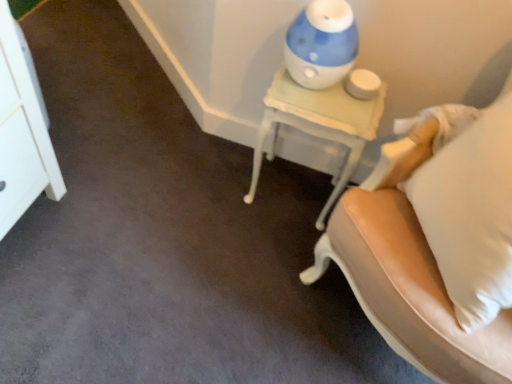
Question: Is white leather chair at right located outside white painted wood nightstand at upper right?

Choices:
 (A) no
 (B) yes

Answer: (B)

Question: From a real-world perspective, is white leather chair at right under white painted wood nightstand at upper right?

Choices:
 (A) yes
 (B) no

Answer: (B)

Question: Considering the relative sizes of white leather chair at right and white painted wood nightstand at upper right in the image provided, is white leather chair at right thinner than white painted wood nightstand at upper right?

Choices:
 (A) yes
 (B) no

Answer: (B)

Question: Are white leather chair at right and white painted wood nightstand at upper right located far from each other?

Choices:
 (A) yes
 (B) no

Answer: (B)

Question: Is white leather chair at right bigger than white painted wood nightstand at upper right?

Choices:
 (A) yes
 (B) no

Answer: (A)

Question: Considering the relative positions of white leather chair at right and white painted wood nightstand at upper right in the image provided, is white leather chair at right to the right of white painted wood nightstand at upper right from the viewer's perspective?

Choices:
 (A) yes
 (B) no

Answer: (A)

Question: From the image's perspective, does white painted wood nightstand at upper right appear higher than white glossy dresser at upper left?

Choices:
 (A) no
 (B) yes

Answer: (A)

Question: From a real-world perspective, is white painted wood nightstand at upper right positioned under white glossy dresser at upper left based on gravity?

Choices:
 (A) yes
 (B) no

Answer: (A)

Question: Is white painted wood nightstand at upper right smaller than white glossy dresser at upper left?

Choices:
 (A) no
 (B) yes

Answer: (A)

Question: Is white painted wood nightstand at upper right positioned beyond the bounds of white glossy dresser at upper left?

Choices:
 (A) yes
 (B) no

Answer: (A)

Question: Does white painted wood nightstand at upper right have a greater width compared to white glossy dresser at upper left?

Choices:
 (A) no
 (B) yes

Answer: (B)

Question: Does white painted wood nightstand at upper right turn towards white glossy dresser at upper left?

Choices:
 (A) yes
 (B) no

Answer: (B)

Question: Can you confirm if blue plastic humidifier at upper right is shorter than white leather chair at right?

Choices:
 (A) no
 (B) yes

Answer: (B)